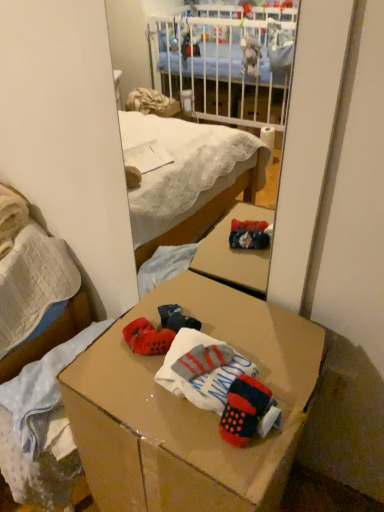
Question: Does cardboard box at center appear on the right side of knitted wool socks at center?

Choices:
 (A) no
 (B) yes

Answer: (A)

Question: From a real-world perspective, is cardboard box at center located beneath knitted wool socks at center?

Choices:
 (A) yes
 (B) no

Answer: (A)

Question: Considering the relative sizes of cardboard box at center and knitted wool socks at center in the image provided, is cardboard box at center shorter than knitted wool socks at center?

Choices:
 (A) yes
 (B) no

Answer: (B)

Question: Could knitted wool socks at center be considered to be inside cardboard box at center?

Choices:
 (A) yes
 (B) no

Answer: (A)

Question: Is cardboard box at center to the left of knitted wool socks at center from the viewer's perspective?

Choices:
 (A) no
 (B) yes

Answer: (B)

Question: Based on their positions, is cardboard box at center located to the left or right of knitted wool socks at center?

Choices:
 (A) left
 (B) right

Answer: (A)

Question: Is cardboard box at center taller or shorter than knitted wool socks at center?

Choices:
 (A) tall
 (B) short

Answer: (A)

Question: Is cardboard box at center bigger or smaller than knitted wool socks at center?

Choices:
 (A) small
 (B) big

Answer: (B)

Question: Considering their positions, is cardboard box at center located in front of or behind knitted wool socks at center?

Choices:
 (A) front
 (B) behind

Answer: (A)

Question: From the image's perspective, is cardboard box at center positioned above or below matte cardboard box at lower center?

Choices:
 (A) below
 (B) above

Answer: (A)

Question: Is cardboard box at center inside or outside of matte cardboard box at lower center?

Choices:
 (A) outside
 (B) inside

Answer: (A)

Question: Is cardboard box at center taller or shorter than matte cardboard box at lower center?

Choices:
 (A) short
 (B) tall

Answer: (B)

Question: Considering their positions, is cardboard box at center located in front of or behind matte cardboard box at lower center?

Choices:
 (A) behind
 (B) front

Answer: (B)

Question: Considering the positions of point (246, 374) and point (215, 416), is point (246, 374) closer or farther from the camera than point (215, 416)?

Choices:
 (A) closer
 (B) farther

Answer: (B)

Question: From their relative heights in the image, would you say knitted wool socks at center is taller or shorter than cardboard box at center?

Choices:
 (A) short
 (B) tall

Answer: (A)